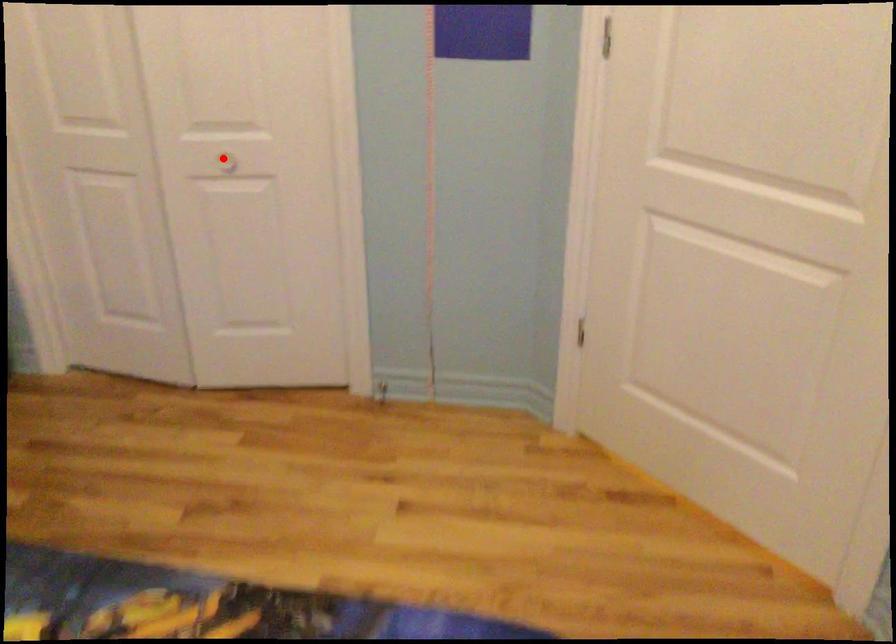
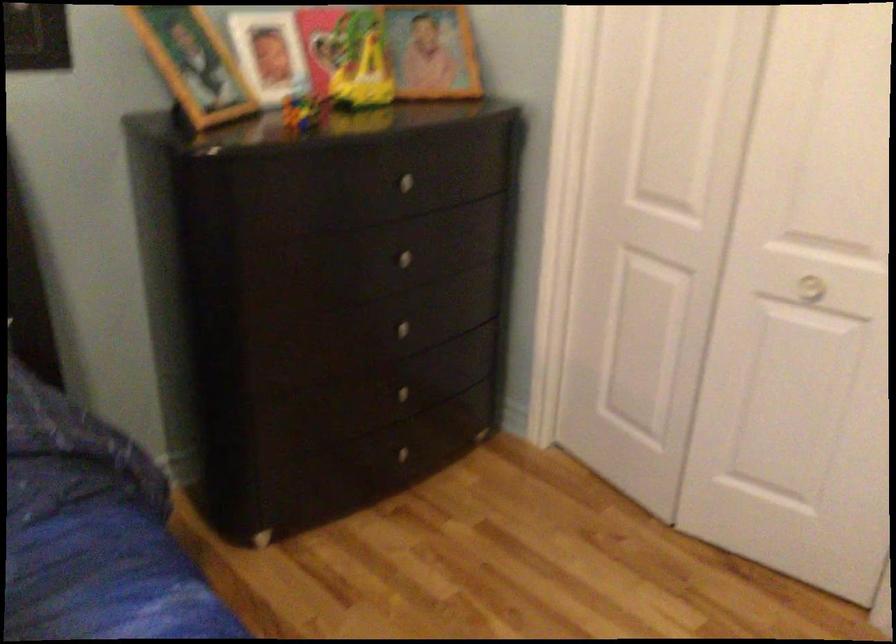
Question: I am providing you with two images of the same scene from different viewpoints. A red point is shown in image1. For the corresponding object point in image2, is it positioned nearer or farther from the camera?

Choices:
 (A) Nearer
 (B) Farther

Answer: (A)